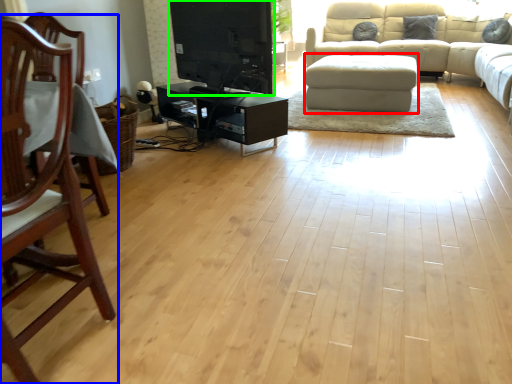
Question: Which object is the farthest from footrest (highlighted by a red box)? Choose among these: chair (highlighted by a blue box) or entertainment center (highlighted by a green box).

Choices:
 (A) chair
 (B) entertainment center

Answer: (A)